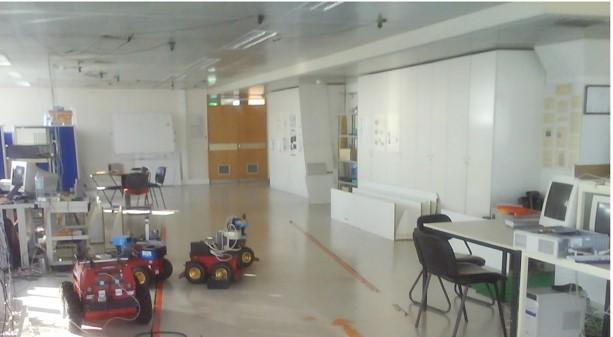
At what (x,y) coordinates should I click in order to perform the action: click on arrow on floor. Please return your answer as a coordinate pair (x, y). Looking at the image, I should click on (340, 321).